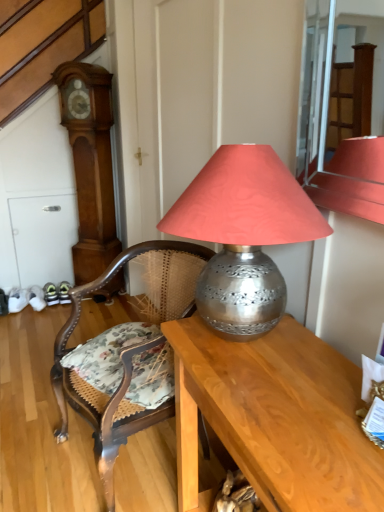
Question: Does metallic silver lamp at center have a larger size compared to wooden grandfather clock at left?

Choices:
 (A) no
 (B) yes

Answer: (A)

Question: Is wooden grandfather clock at left surrounded by metallic silver lamp at center?

Choices:
 (A) yes
 (B) no

Answer: (B)

Question: From a real-world perspective, is metallic silver lamp at center physically above wooden grandfather clock at left?

Choices:
 (A) yes
 (B) no

Answer: (A)

Question: Is metallic silver lamp at center positioned before wooden grandfather clock at left?

Choices:
 (A) no
 (B) yes

Answer: (B)

Question: Is metallic silver lamp at center looking in the opposite direction of wooden grandfather clock at left?

Choices:
 (A) no
 (B) yes

Answer: (A)

Question: From the image's perspective, is wooden cane chair at center above or below wooden desk at center?

Choices:
 (A) below
 (B) above

Answer: (B)

Question: From a real-world perspective, is wooden cane chair at center above or below wooden desk at center?

Choices:
 (A) above
 (B) below

Answer: (A)

Question: Is wooden cane chair at center taller or shorter than wooden desk at center?

Choices:
 (A) tall
 (B) short

Answer: (A)

Question: Considering the positions of wooden cane chair at center and wooden desk at center in the image, is wooden cane chair at center wider or thinner than wooden desk at center?

Choices:
 (A) thin
 (B) wide

Answer: (B)

Question: Based on their positions, is metallic silver lamp at center located to the left or right of wooden cane chair at center?

Choices:
 (A) left
 (B) right

Answer: (B)

Question: Looking at their shapes, would you say metallic silver lamp at center is wider or thinner than wooden cane chair at center?

Choices:
 (A) wide
 (B) thin

Answer: (B)

Question: Is point (236, 334) closer or farther from the camera than point (97, 373)?

Choices:
 (A) closer
 (B) farther

Answer: (A)

Question: From a real-world perspective, is metallic silver lamp at center physically located above or below wooden cane chair at center?

Choices:
 (A) above
 (B) below

Answer: (A)

Question: Considering the positions of metallic silver lamp at center and wooden grandfather clock at left in the image, is metallic silver lamp at center wider or thinner than wooden grandfather clock at left?

Choices:
 (A) wide
 (B) thin

Answer: (A)

Question: Based on their sizes in the image, would you say metallic silver lamp at center is bigger or smaller than wooden grandfather clock at left?

Choices:
 (A) small
 (B) big

Answer: (A)